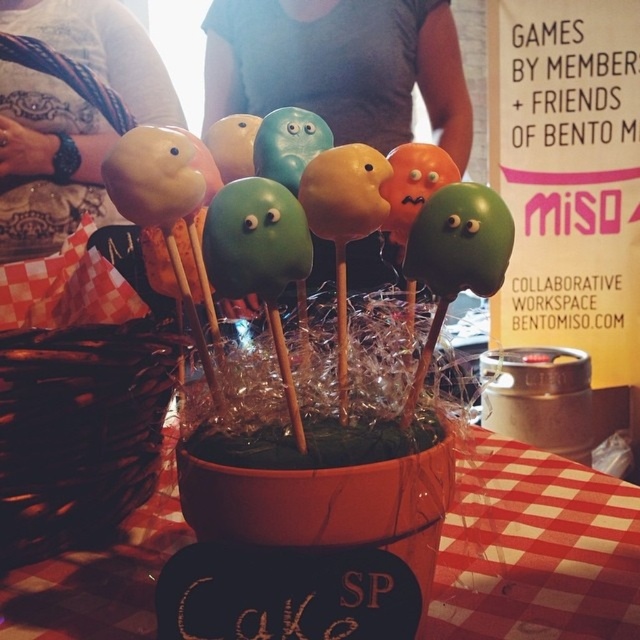
Question: Which object is positioned closest to the matte black cake pops at left?

Choices:
 (A) red checkered tablecloth at center
 (B) brown woven basket at center
 (C) matte gray shirt at center

Answer: (C)

Question: Is red checkered tablecloth at center closer to the viewer compared to brown woven basket at center?

Choices:
 (A) no
 (B) yes

Answer: (B)

Question: Which of these objects is positioned closest to the red checkered tablecloth at center?

Choices:
 (A) matte gray shirt at center
 (B) matte black cake pops at left
 (C) brown woven basket at center

Answer: (C)

Question: Among these objects, which one is nearest to the camera?

Choices:
 (A) red checkered tablecloth at center
 (B) matte black cake pops at left
 (C) brown woven basket at center
 (D) matte gray shirt at center

Answer: (A)

Question: Considering the relative positions of red checkered tablecloth at center and matte gray shirt at center in the image provided, where is red checkered tablecloth at center located with respect to matte gray shirt at center?

Choices:
 (A) left
 (B) right

Answer: (B)

Question: Can you confirm if matte gray shirt at center is wider than matte black cake pops at left?

Choices:
 (A) no
 (B) yes

Answer: (B)